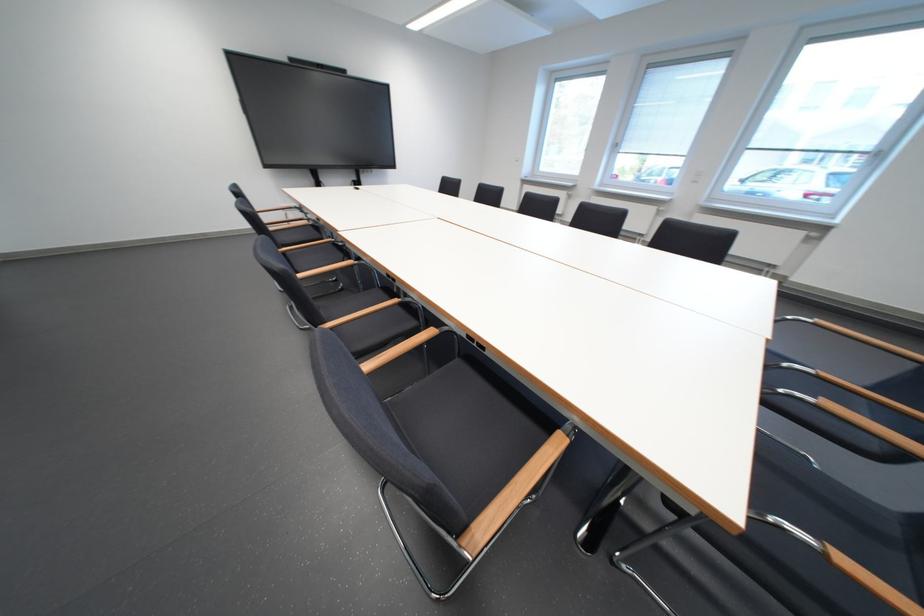
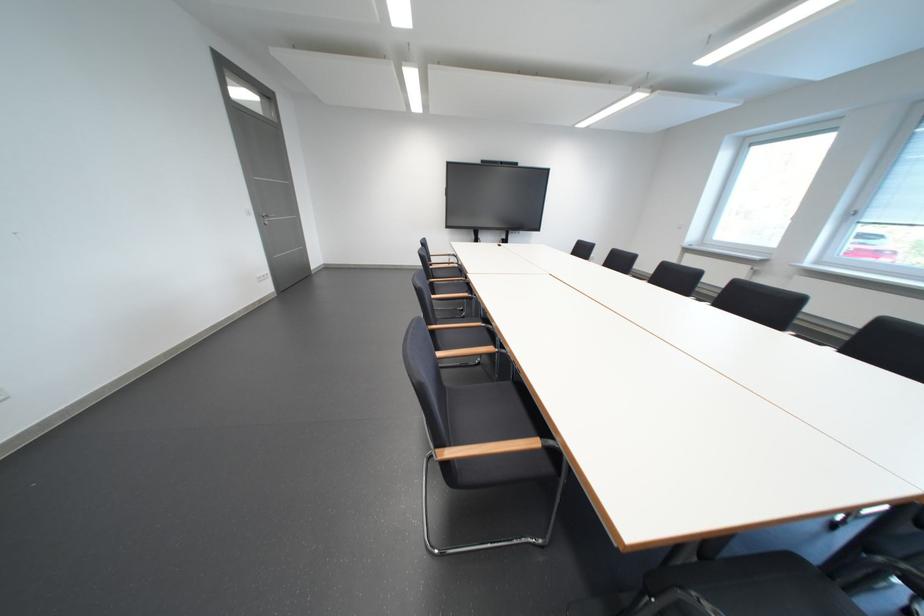
The point at [470,363] is marked in the first image. Where is the corresponding point in the second image?

(523, 386)